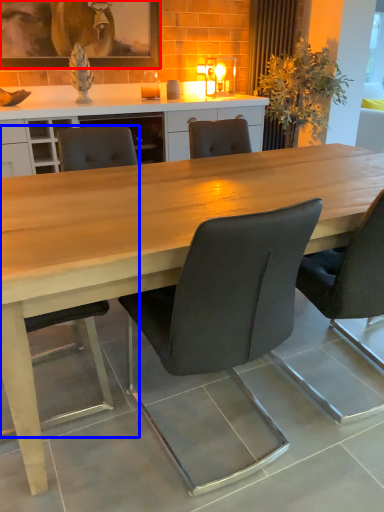
Question: Among these objects, which one is farthest to the camera, picture frame (highlighted by a red box) or chair (highlighted by a blue box)?

Choices:
 (A) picture frame
 (B) chair

Answer: (A)